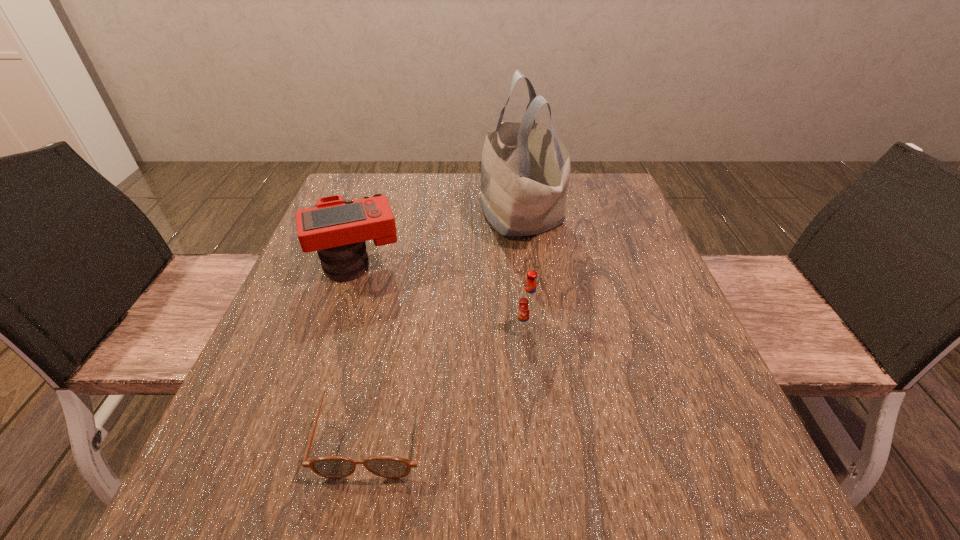
You are a GUI agent. You are given a task and a screenshot of the screen. Output one action in this format:
    pyautogui.click(x=<x>, y=<y>)
    Task: Click on the camera that is at the left edge
    Image resolution: width=960 pixels, height=540 pixels.
    Given the screenshot: What is the action you would take?
    pyautogui.click(x=337, y=229)

Where is `sunglasses present at the left edge`? sunglasses present at the left edge is located at coordinates (334, 467).

Image resolution: width=960 pixels, height=540 pixels. I want to click on object present at the near left corner, so click(x=334, y=467).

In the image, there is a desktop. Where is `vacant space at the far edge`? vacant space at the far edge is located at coordinates (460, 187).

What are the coordinates of `blank space at the near edge of the desktop` in the screenshot? It's located at (618, 532).

In the image, there is a desktop. What are the coordinates of `blank space at the left edge` in the screenshot? It's located at (302, 376).

The image size is (960, 540). Find the location of `free spot at the right edge of the desktop`. free spot at the right edge of the desktop is located at coordinates (592, 264).

This screenshot has width=960, height=540. In order to click on free region at the far left corner of the desktop in this screenshot , I will do `click(358, 184)`.

In the image, there is a desktop. At what (x,y) coordinates should I click in order to perform the action: click on free region at the far right corner. Please return your answer as a coordinate pair (x, y). This screenshot has width=960, height=540. Looking at the image, I should click on (603, 202).

Where is `vacant space at the near right corner of the desktop`? The width and height of the screenshot is (960, 540). vacant space at the near right corner of the desktop is located at coordinates (741, 518).